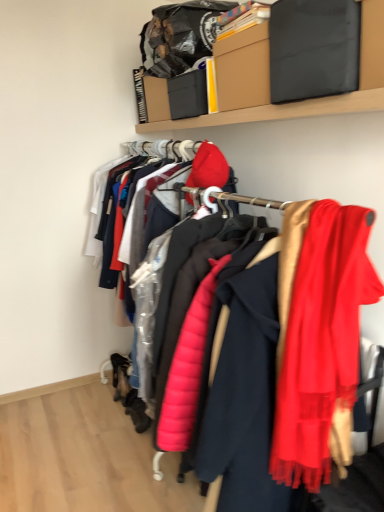
Locate an element on the screen. This screenshot has height=512, width=384. silky red scarf at right is located at coordinates (322, 340).

The height and width of the screenshot is (512, 384). What do you see at coordinates (322, 340) in the screenshot?
I see `silky red scarf at right` at bounding box center [322, 340].

Locate an element on the screen. silky red scarf at right is located at coordinates (322, 340).